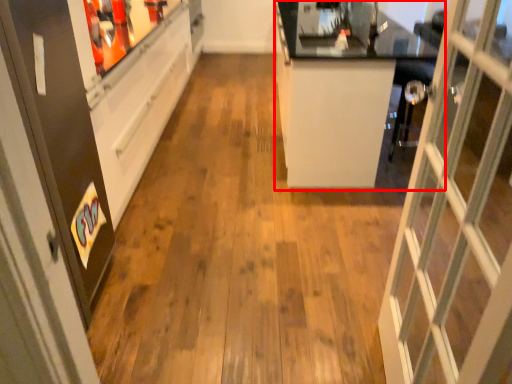
Question: From the image's perspective, where is counter (annotated by the red box) located relative to screen door?

Choices:
 (A) below
 (B) above

Answer: (B)